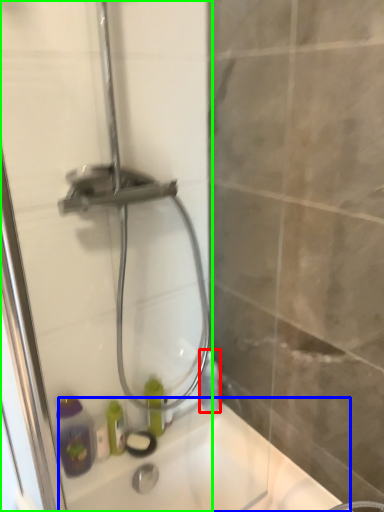
Question: Which is farther away from bottle (highlighted by a red box)? bath (highlighted by a blue box) or shower door (highlighted by a green box)?

Choices:
 (A) bath
 (B) shower door

Answer: (B)